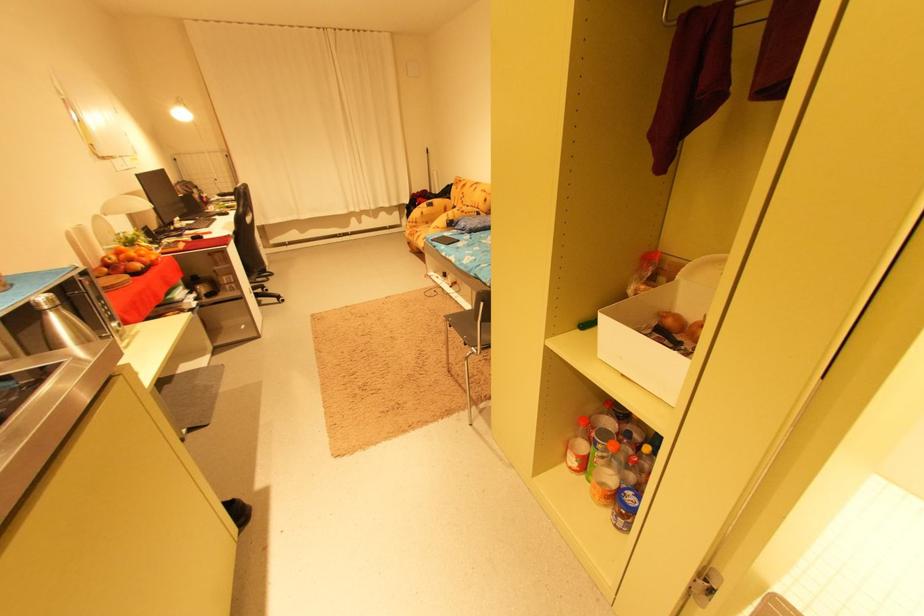
The height and width of the screenshot is (616, 924). What are the coordinates of `metal water bottle` in the screenshot? It's located at (614, 460).